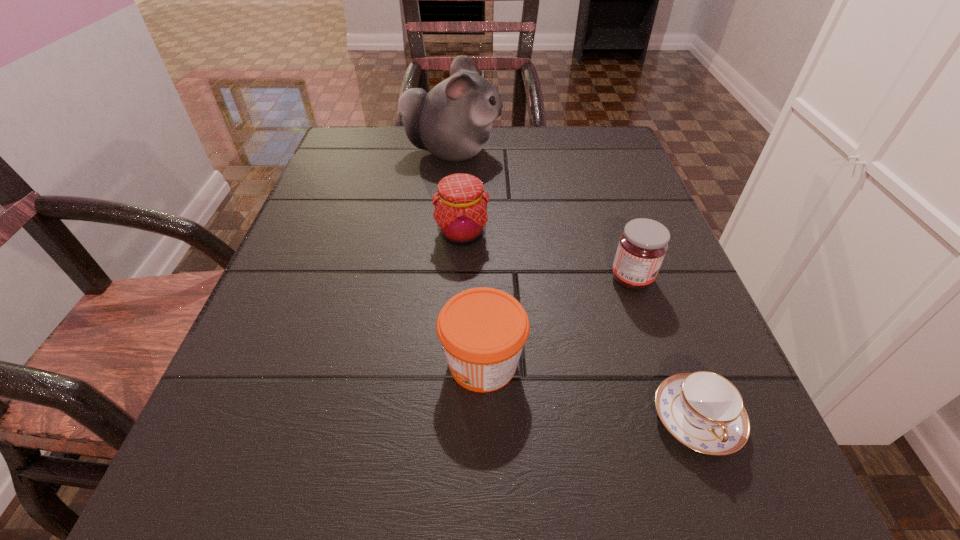
Locate an element on the screen. The width and height of the screenshot is (960, 540). free area in between the rightmost jam and the second farthest object is located at coordinates (547, 256).

Where is `object that is the nearest to the second farthest object`? object that is the nearest to the second farthest object is located at coordinates (452, 121).

Point out which object is positioned as the third nearest to the shortest object. Please provide its 2D coordinates. Your answer should be formatted as a tuple, i.e. [(x, y)], where the tuple contains the x and y coordinates of a point satisfying the conditions above.

[(460, 212)]

Where is `the second closest jam relative to the farthest object`? The image size is (960, 540). the second closest jam relative to the farthest object is located at coordinates (642, 246).

Identify which jam is located as the second nearest to the rightmost jam. Please provide its 2D coordinates. Your answer should be formatted as a tuple, i.e. [(x, y)], where the tuple contains the x and y coordinates of a point satisfying the conditions above.

[(460, 212)]

You are a GUI agent. You are given a task and a screenshot of the screen. Output one action in this format:
    pyautogui.click(x=<x>, y=<y>)
    Task: Click on the blank area in the image that satisfies the following two spatial constraints: 1. on the face of the hamster; 2. on the left side of the second farthest object
    
    Given the screenshot: What is the action you would take?
    click(445, 234)